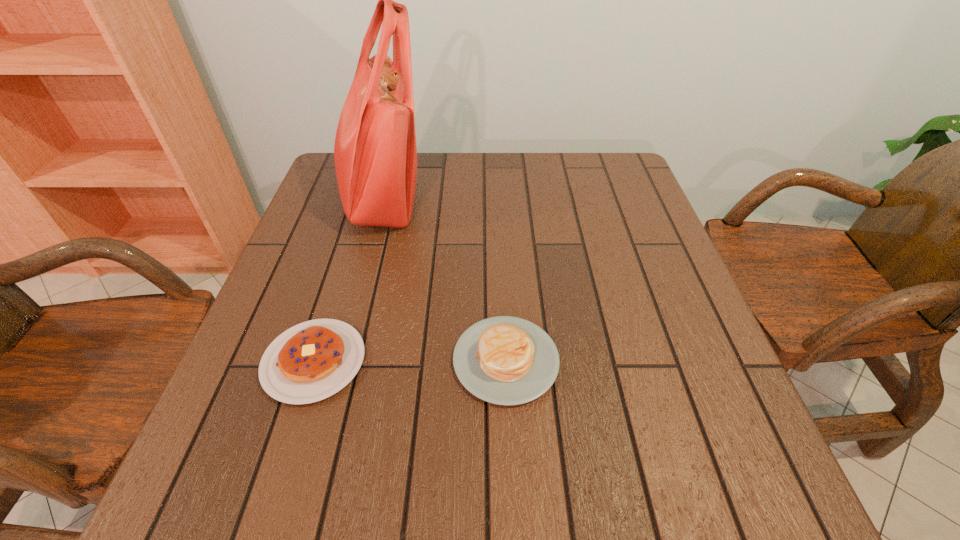
Find the location of a particular element. This screenshot has height=540, width=960. free space that satisfies the following two spatial constraints: 1. on the front-facing side of the handbag; 2. on the front side of the left pancake is located at coordinates (x=335, y=361).

The image size is (960, 540). I want to click on vacant space that satisfies the following two spatial constraints: 1. on the front-facing side of the taller pancake; 2. on the right side of the handbag, so click(336, 360).

You are a GUI agent. You are given a task and a screenshot of the screen. Output one action in this format:
    pyautogui.click(x=<x>, y=<y>)
    Task: Click on the free space that satisfies the following two spatial constraints: 1. on the back side of the taller pancake; 2. on the front-facing side of the handbag
    This screenshot has width=960, height=540.
    Given the screenshot: What is the action you would take?
    pyautogui.click(x=498, y=197)

At what (x,y) coordinates should I click in order to perform the action: click on blank space that satisfies the following two spatial constraints: 1. on the back side of the left pancake; 2. on the right side of the right pancake. Please return your answer as a coordinate pair (x, y). The height and width of the screenshot is (540, 960). Looking at the image, I should click on (315, 360).

Identify the location of vacant region that satisfies the following two spatial constraints: 1. on the back side of the second shortest object; 2. on the front-facing side of the tallest object. (498, 197).

This screenshot has width=960, height=540. Find the location of `vacant space that satisfies the following two spatial constraints: 1. on the back side of the rightmost object; 2. on the right side of the shorter pancake`. vacant space that satisfies the following two spatial constraints: 1. on the back side of the rightmost object; 2. on the right side of the shorter pancake is located at coordinates (315, 360).

Locate an element on the screen. blank area in the image that satisfies the following two spatial constraints: 1. on the front-facing side of the handbag; 2. on the right side of the rightmost object is located at coordinates (336, 360).

You are a GUI agent. You are given a task and a screenshot of the screen. Output one action in this format:
    pyautogui.click(x=<x>, y=<y>)
    Task: Click on the vacant position in the image that satisfies the following two spatial constraints: 1. on the back side of the rightmost object; 2. on the front-facing side of the farthest object
    This screenshot has width=960, height=540.
    Given the screenshot: What is the action you would take?
    pyautogui.click(x=498, y=197)